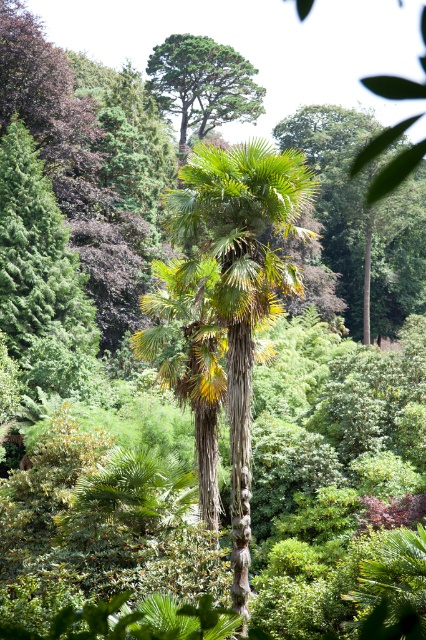
Question: Can you confirm if green leafy palm tree at center is bigger than green leafy tree at upper center?

Choices:
 (A) no
 (B) yes

Answer: (B)

Question: Which object is closer to the camera taking this photo?

Choices:
 (A) green leafy palm tree at center
 (B) green leafy tree at upper center
 (C) green leafy palm at center

Answer: (C)

Question: Does green leafy palm at center appear over green leafy tree at upper center?

Choices:
 (A) no
 (B) yes

Answer: (A)

Question: Does green leafy palm tree at center appear on the right side of green leafy tree at upper center?

Choices:
 (A) no
 (B) yes

Answer: (B)

Question: Which point is farther to the camera?

Choices:
 (A) green leafy palm tree at center
 (B) green leafy tree at upper center

Answer: (B)

Question: Which is farther from the green leafy palm tree at center?

Choices:
 (A) green leafy palm at center
 (B) green leafy tree at upper center

Answer: (B)